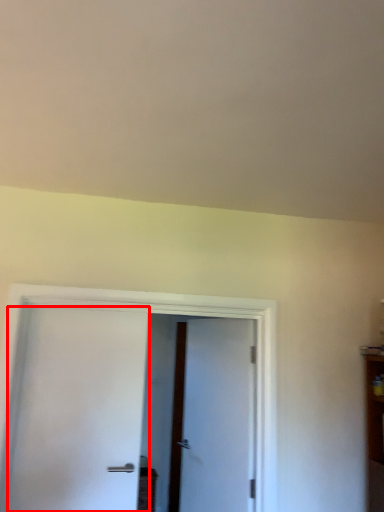
Question: Observing the image, what is the correct spatial positioning of door (annotated by the red box) in reference to door?

Choices:
 (A) left
 (B) right

Answer: (A)